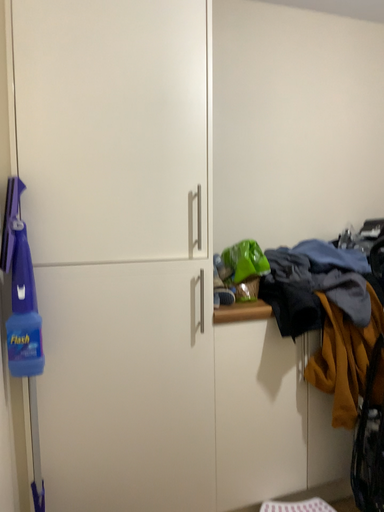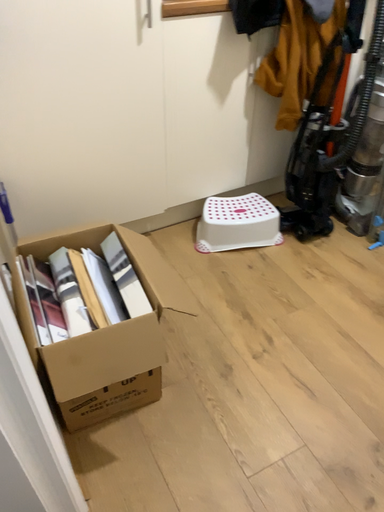
Question: How did the camera likely rotate when shooting the video?

Choices:
 (A) rotated upward
 (B) rotated downward

Answer: (B)